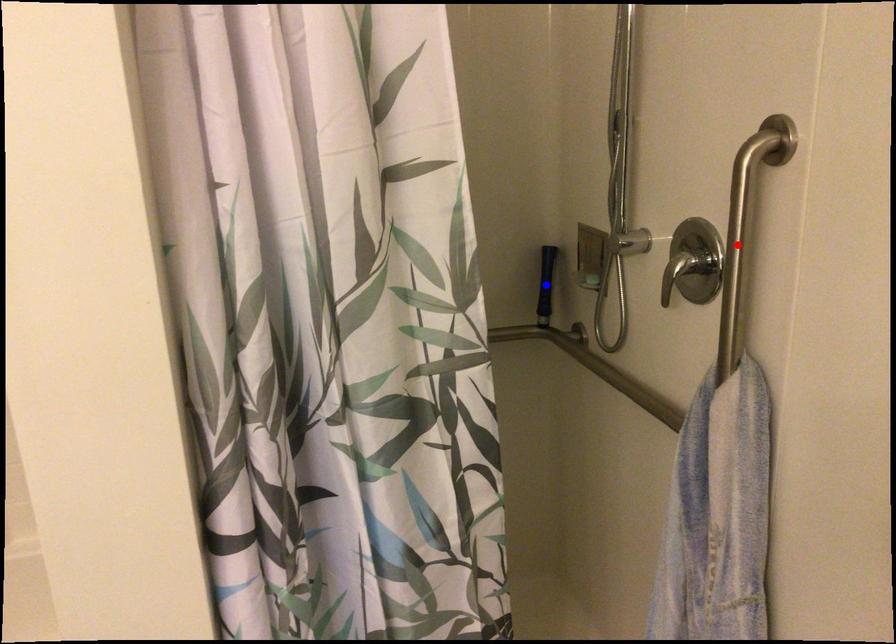
Question: In the image, two points are highlighted. Which point is nearer to the camera? Reply with the corresponding letter.

Choices:
 (A) blue point
 (B) red point

Answer: (B)